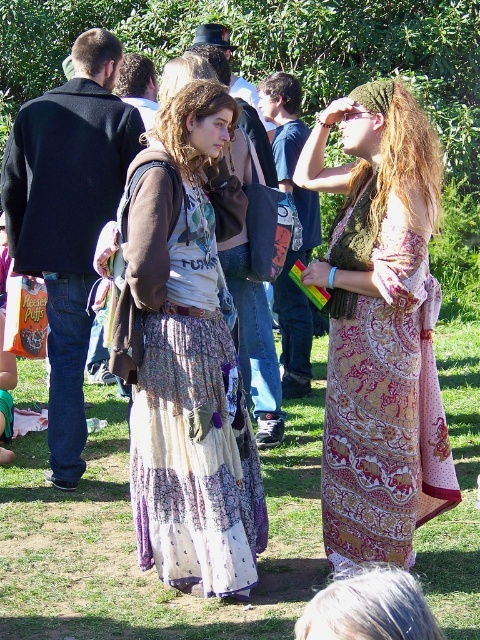
You are a photographer setting up a tripod to capture the scene. The printed cotton skirt at center and the patterned fabric dress at center are both in your frame. If your camera has a minimum distance requirement of 30 inches between subjects to avoid blurring, will you need to adjust the tripod position?

The printed cotton skirt at center is 28.46 inches from the patterned fabric dress at center. Since this distance is less than the 30 inches required to avoid blurring, you will need to adjust the tripod position to increase the distance between them in the frame.

From the picture: You are standing at the position of point (373, 138) and want to walk to the other side of the park. There is a point (211, 476) in your path. Is this point in front of or behind you relative to your direction of travel?

The point (211, 476) is in front of point (373, 138), so it is in front of you relative to your direction of travel.